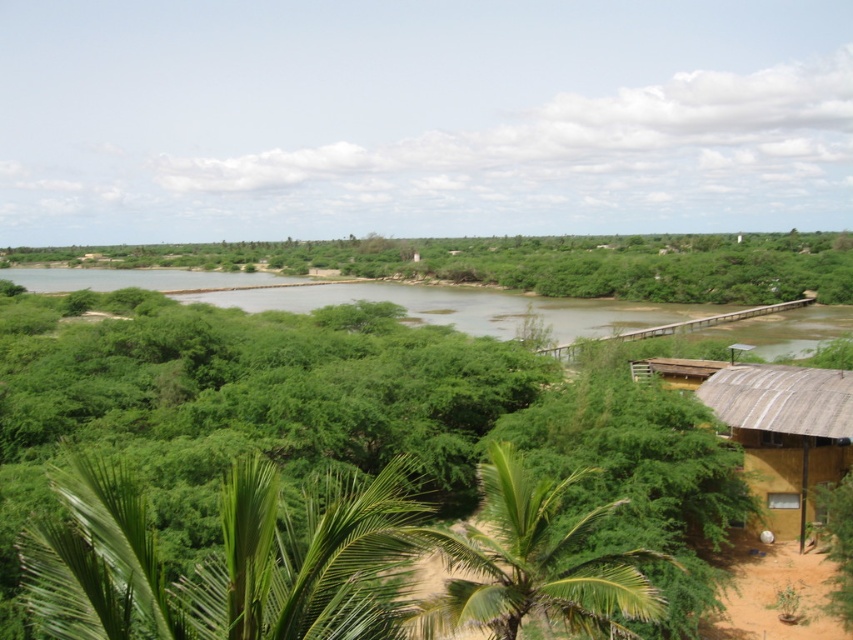
Question: Which of the following is the farthest from the observer?

Choices:
 (A) (799, 436)
 (B) (296, 620)
 (C) (636, 264)

Answer: (C)

Question: Can you confirm if green leafy palm tree at lower center is bigger than brown corrugated metal hut at lower right?

Choices:
 (A) yes
 (B) no

Answer: (A)

Question: Which point is farther to the camera?

Choices:
 (A) (531, 600)
 (B) (322, 520)

Answer: (A)

Question: Which of these objects is positioned closest to the green leafy palm tree at lower left?

Choices:
 (A) green leafy palm tree at lower center
 (B) brown corrugated metal hut at lower right

Answer: (A)

Question: Is green leafy palm tree at lower center bigger than brown corrugated metal hut at lower right?

Choices:
 (A) yes
 (B) no

Answer: (A)

Question: Is green leafy palm tree at lower center smaller than brown corrugated metal hut at lower right?

Choices:
 (A) no
 (B) yes

Answer: (A)